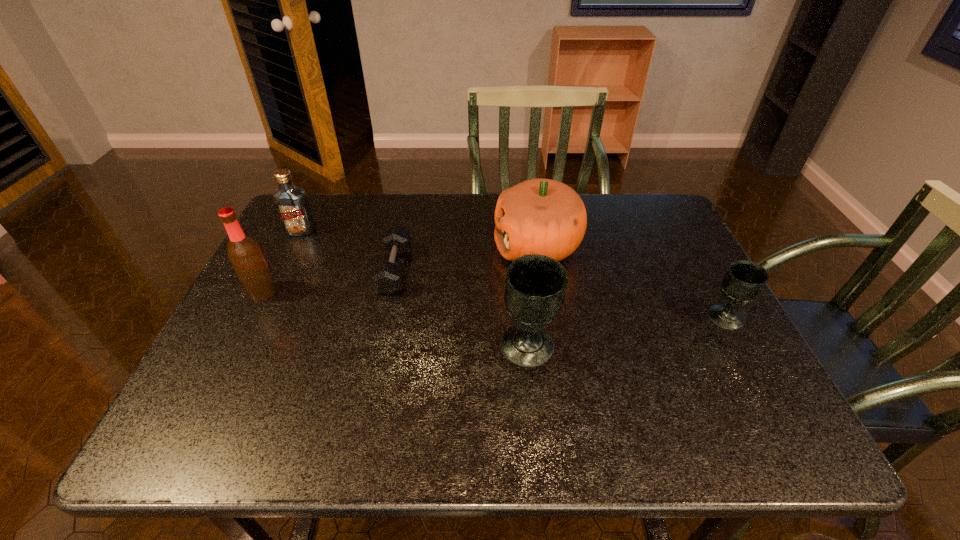
Identify the location of free location located 0.200m on the face of the pumpkin. The width and height of the screenshot is (960, 540). (423, 246).

This screenshot has height=540, width=960. I want to click on free space located on the face of the pumpkin, so click(x=359, y=246).

In order to click on vacant area situated 0.050m on the face of the pumpkin in this screenshot , I will do `click(476, 246)`.

Image resolution: width=960 pixels, height=540 pixels. I want to click on vacant position located 0.060m on the front-facing side of the vodka, so click(x=292, y=250).

The image size is (960, 540). Identify the location of free spot located on the back of the third object from left to right. (408, 205).

I want to click on vacant space located 0.240m on the front of the beer bottle, so click(214, 386).

This screenshot has height=540, width=960. Identify the location of pumpkin situated at the far edge. (546, 217).

Locate an element on the screen. The height and width of the screenshot is (540, 960). vodka positioned at the far edge is located at coordinates (291, 202).

You are a GUI agent. You are given a task and a screenshot of the screen. Output one action in this format:
    pyautogui.click(x=<x>, y=<y>)
    Task: Click on the object at the near edge
    This screenshot has height=540, width=960.
    Given the screenshot: What is the action you would take?
    pyautogui.click(x=535, y=288)

Locate an element on the screen. Image resolution: width=960 pixels, height=540 pixels. vodka present at the left edge is located at coordinates (291, 202).